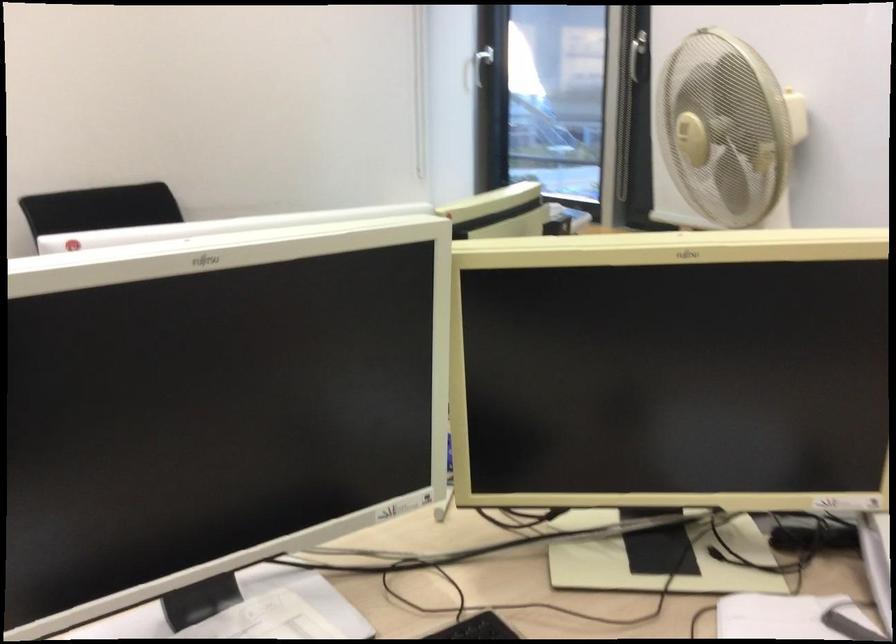
The width and height of the screenshot is (896, 644). Find the location of `white window handle`. white window handle is located at coordinates click(476, 69).